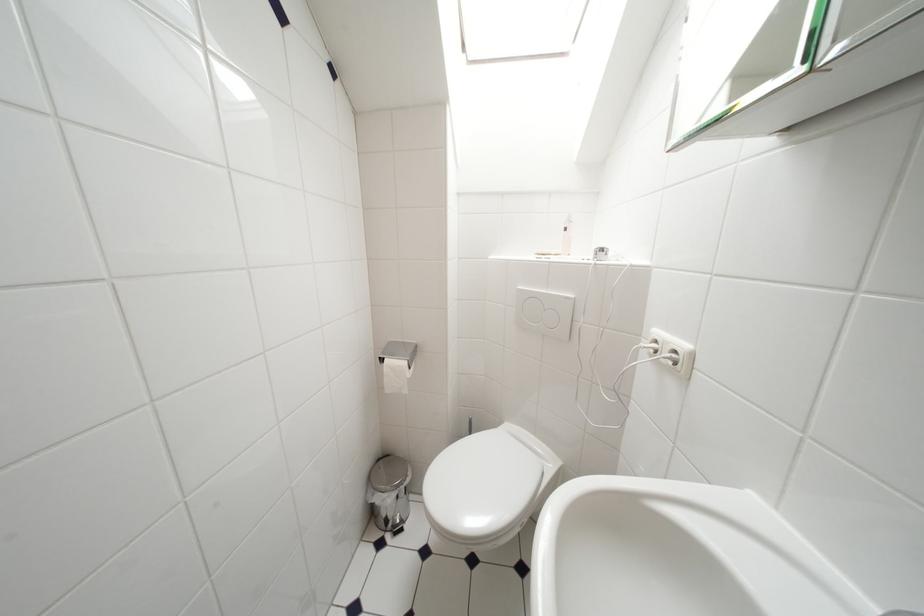
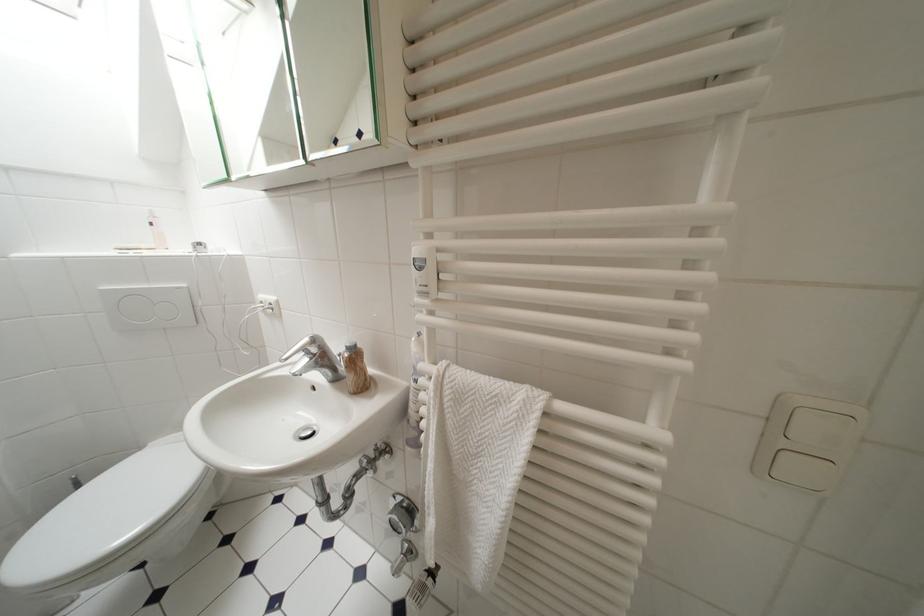
Question: I am providing you with two images of the same scene from different viewpoints. After the viewpoint changes to image2, which objects are now occluded?

Choices:
 (A) large flush button
 (B) pink bottle
 (C) small flush button
 (D) none of these

Answer: (D)